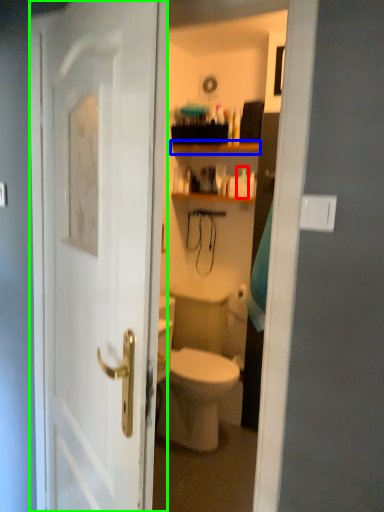
Question: Estimate the real-world distances between objects in this image. Which object is farther from toiletry (highlighted by a red box), shelf (highlighted by a blue box) or door (highlighted by a green box)?

Choices:
 (A) shelf
 (B) door

Answer: (B)